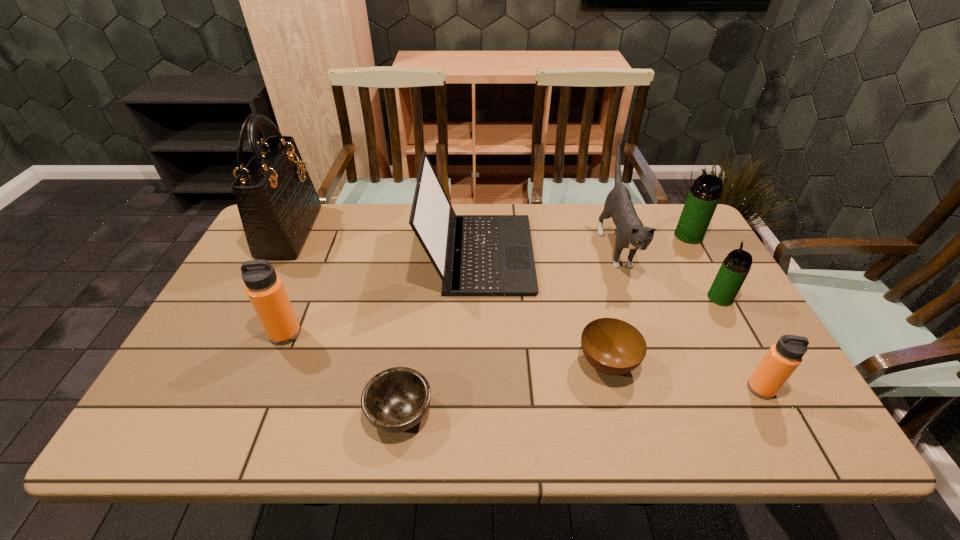
Where is `object that is the second closest to the tallest object`? This screenshot has width=960, height=540. object that is the second closest to the tallest object is located at coordinates (475, 255).

Point out which thermos bottle is positioned as the third nearest to the farthest thermos bottle. Please provide its 2D coordinates. Your answer should be formatted as a tuple, i.e. [(x, y)], where the tuple contains the x and y coordinates of a point satisfying the conditions above.

[(265, 290)]

Select which thermos bottle is the third closest to the farther green thermos bottle. Please provide its 2D coordinates. Your answer should be formatted as a tuple, i.e. [(x, y)], where the tuple contains the x and y coordinates of a point satisfying the conditions above.

[(265, 290)]

This screenshot has height=540, width=960. I want to click on free spot that satisfies the following two spatial constraints: 1. at the front of the tallest object with visible charms; 2. on the right side of the smaller orange thermos bottle, so click(x=209, y=388).

The width and height of the screenshot is (960, 540). In order to click on blank space that satisfies the following two spatial constraints: 1. at the front of the leftmost object with visible charms; 2. on the back side of the right orange thermos bottle in this screenshot , I will do `click(209, 388)`.

The image size is (960, 540). In order to click on vacant area in the image that satisfies the following two spatial constraints: 1. at the front of the leftmost object with visible charms; 2. on the back side of the farther orange thermos bottle in this screenshot , I will do `click(238, 333)`.